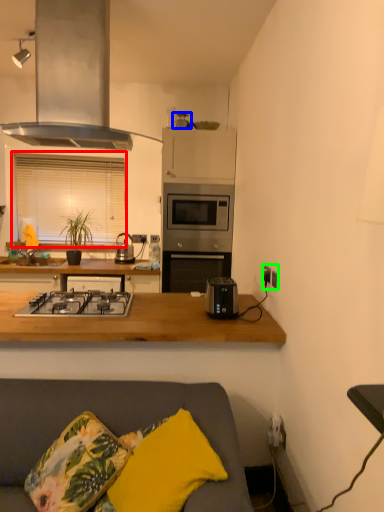
Question: Which object is the closest to the window (highlighted by a red box)? Choose among these: appliance (highlighted by a blue box) or electric outlet (highlighted by a green box).

Choices:
 (A) appliance
 (B) electric outlet

Answer: (A)